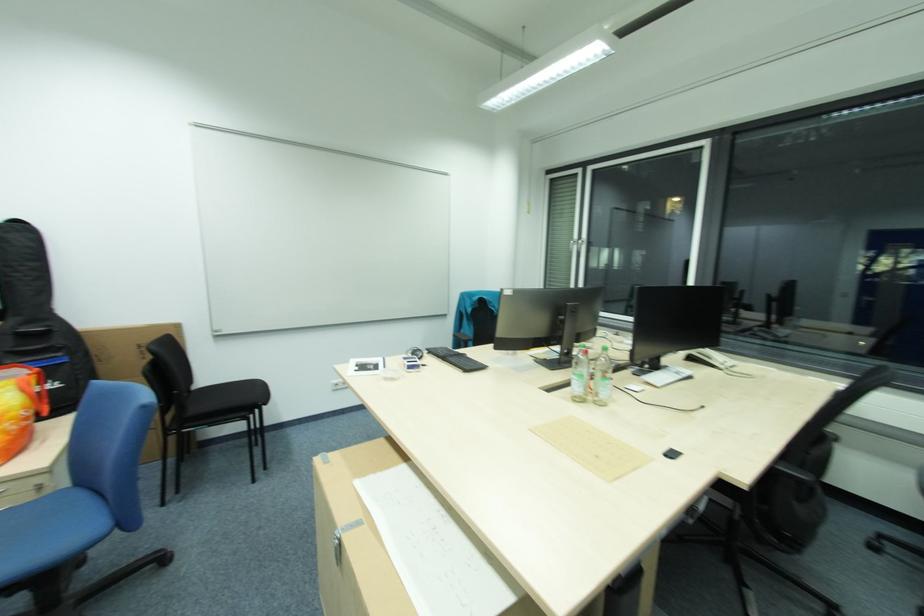
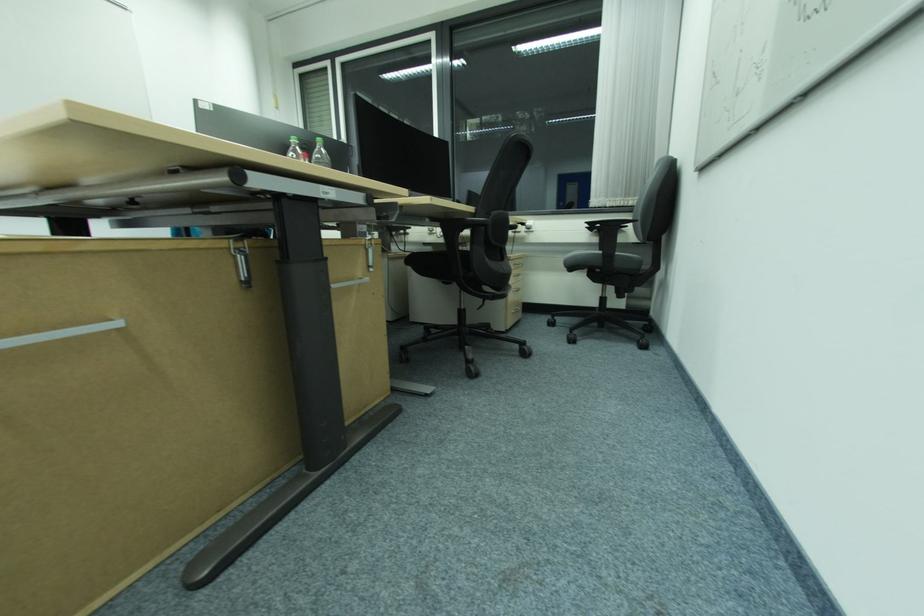
Question: The images are taken continuously from a first-person perspective. In which direction is your viewpoint rotating?

Choices:
 (A) Left
 (B) Right
 (C) Up
 (D) Down

Answer: (B)